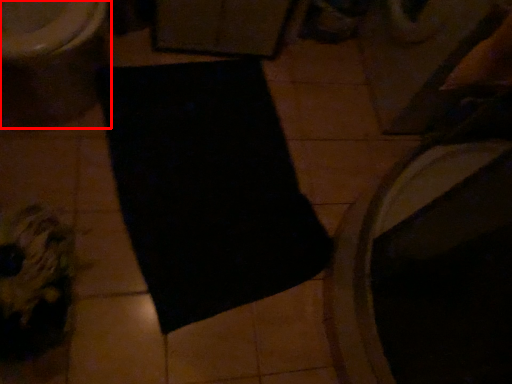
Question: Where is toilet (annotated by the red box) located in relation to yoga mat in the image?

Choices:
 (A) left
 (B) right

Answer: (A)